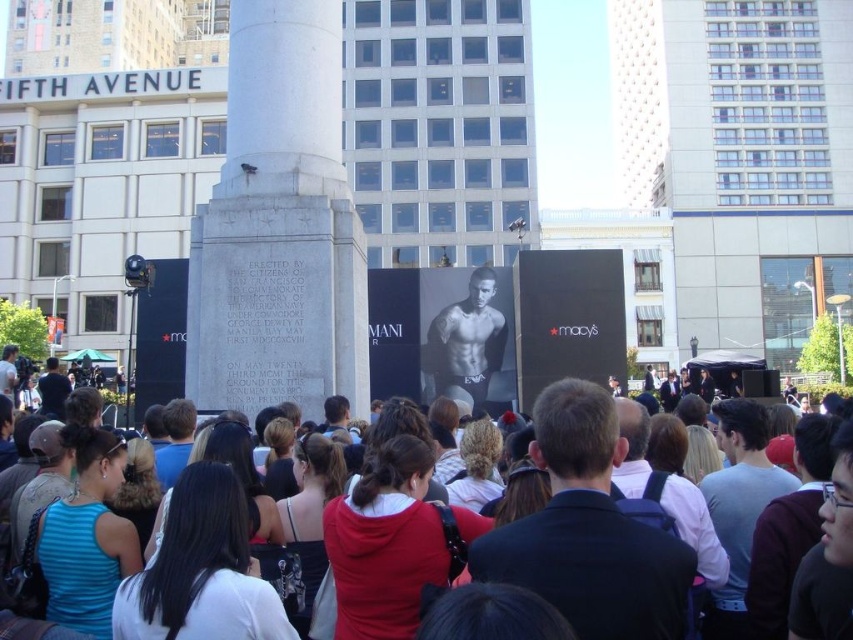
Does white marble monument at center appear on the right side of smooth skin torso at center?

In fact, white marble monument at center is to the left of smooth skin torso at center.

The height and width of the screenshot is (640, 853). What do you see at coordinates (279, 227) in the screenshot?
I see `white marble monument at center` at bounding box center [279, 227].

This screenshot has width=853, height=640. What do you see at coordinates (279, 227) in the screenshot?
I see `white marble monument at center` at bounding box center [279, 227].

Where is `white marble monument at center`? white marble monument at center is located at coordinates (279, 227).

Does white marble monument at center appear under dark blue hoodie at center?

No.

I want to click on white marble monument at center, so click(279, 227).

Is point (216, 234) positioned after point (593, 388)?

Yes, point (216, 234) is farther from viewer.

I want to click on white marble monument at center, so click(279, 227).

Does dark blue hoodie at center appear on the left side of smooth skin torso at center?

Incorrect, dark blue hoodie at center is not on the left side of smooth skin torso at center.

Is dark blue hoodie at center smaller than smooth skin torso at center?

Actually, dark blue hoodie at center might be larger than smooth skin torso at center.

Who is more forward, (782, 524) or (461, 358)?

Point (782, 524) is more forward.

Where is `dark blue hoodie at center`? The height and width of the screenshot is (640, 853). dark blue hoodie at center is located at coordinates (572, 451).